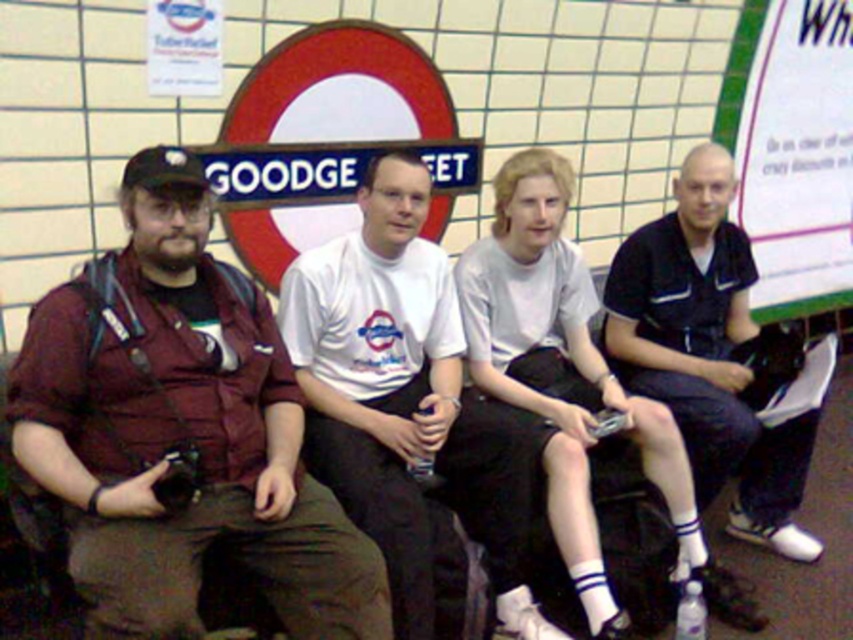
Who is shorter, white cotton t-shirt at center or dark blue polo shirt at center?

white cotton t-shirt at center is shorter.

In the scene shown: Between white cotton t-shirt at center and dark blue polo shirt at center, which one appears on the right side from the viewer's perspective?

dark blue polo shirt at center is more to the right.

Does point (421, 387) come farther from viewer compared to point (796, 502)?

No, it is in front of (796, 502).

Locate an element on the screen. Image resolution: width=853 pixels, height=640 pixels. white cotton t-shirt at center is located at coordinates (404, 401).

Who is positioned more to the left, maroon fabric shirt at left or white cotton t-shirt at center?

Positioned to the left is maroon fabric shirt at left.

Between point (55, 342) and point (393, 250), which one is positioned behind?

Positioned behind is point (393, 250).

This screenshot has width=853, height=640. Describe the element at coordinates (180, 429) in the screenshot. I see `maroon fabric shirt at left` at that location.

The height and width of the screenshot is (640, 853). I want to click on maroon fabric shirt at left, so click(180, 429).

Does point (134, 627) come in front of point (650, 330)?

Yes, point (134, 627) is closer to viewer.

At what (x,y) coordinates should I click in order to perform the action: click on maroon fabric shirt at left. Please return your answer as a coordinate pair (x, y). The height and width of the screenshot is (640, 853). Looking at the image, I should click on (180, 429).